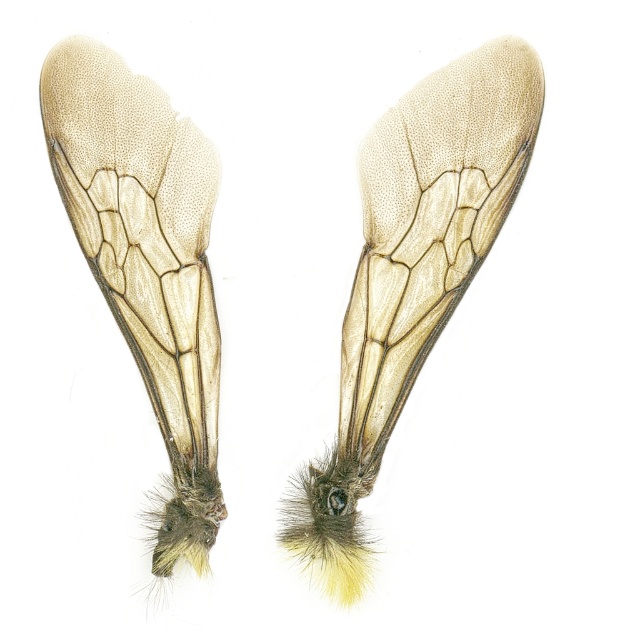
You are an entomologist examining two translucent beige wings on a white background. You notice that one is labeled as translucent beige wings at center and the other as translucent beige wing at center. Based on their positions, which one is located to the right?

The translucent beige wings at center is located to the right of the translucent beige wing at center.

You are an entomologist examining two insect wings on a white background. You have the translucent beige wings at center and the translucent beige wing at center in front of you. Which of these has a greater width?

The translucent beige wings at center has a greater width than the translucent beige wing at center according to the description.